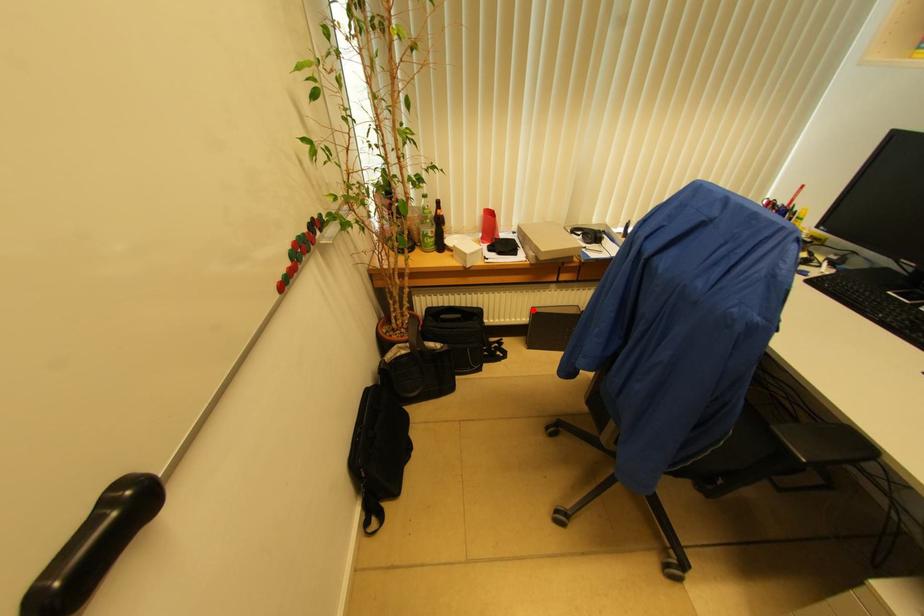
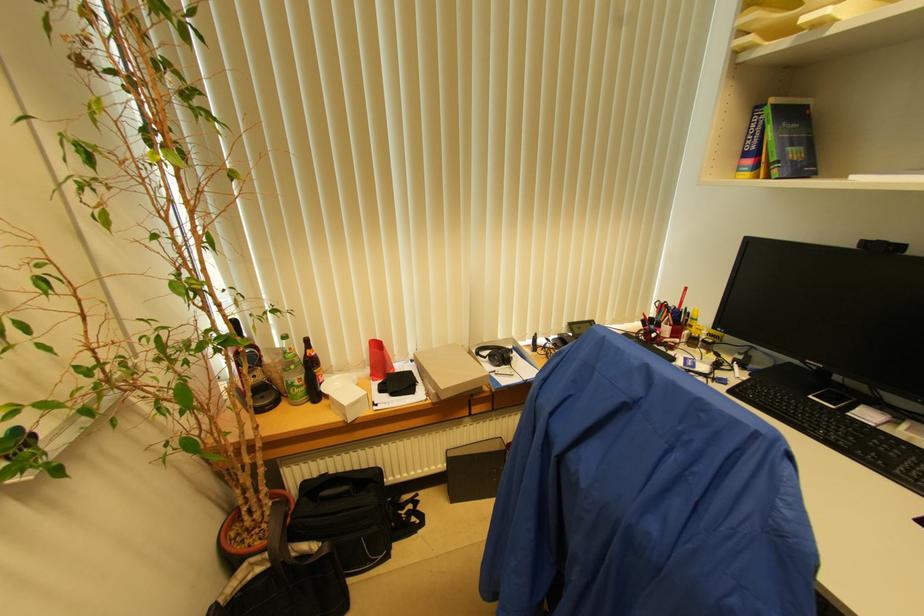
Find the pixel in the second image that matches the highlighted location in the first image.

(447, 453)